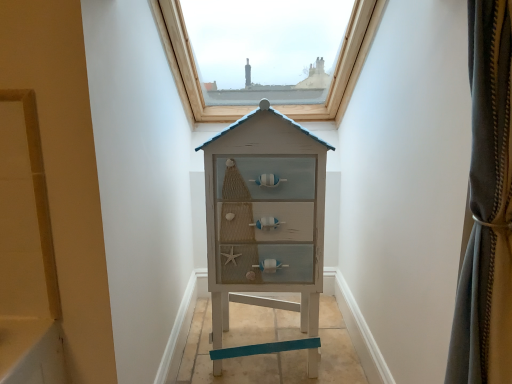
Question: Is point (291, 125) positioned closer to the camera than point (345, 44)?

Choices:
 (A) farther
 (B) closer

Answer: (B)

Question: From their relative heights in the image, would you say white distressed wood chest of drawers at center is taller or shorter than wooden frame at upper center?

Choices:
 (A) short
 (B) tall

Answer: (B)

Question: Would you say white distressed wood chest of drawers at center is inside or outside wooden frame at upper center?

Choices:
 (A) inside
 (B) outside

Answer: (B)

Question: Based on their positions, is wooden frame at upper center located to the left or right of white distressed wood chest of drawers at center?

Choices:
 (A) left
 (B) right

Answer: (A)

Question: Considering their positions, is wooden frame at upper center located in front of or behind white distressed wood chest of drawers at center?

Choices:
 (A) behind
 (B) front

Answer: (A)

Question: In terms of height, does wooden frame at upper center look taller or shorter compared to white distressed wood chest of drawers at center?

Choices:
 (A) tall
 (B) short

Answer: (B)

Question: Considering the positions of wooden frame at upper center and white distressed wood chest of drawers at center in the image, is wooden frame at upper center wider or thinner than white distressed wood chest of drawers at center?

Choices:
 (A) wide
 (B) thin

Answer: (A)